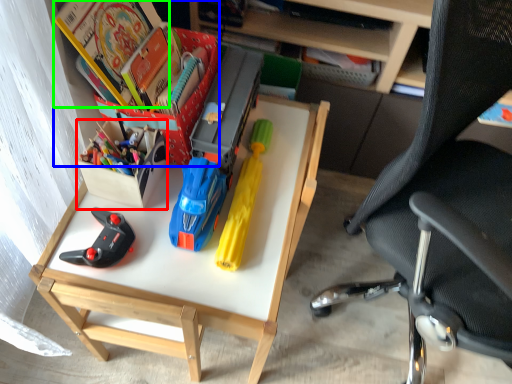
Question: Which object is positioned closest to kit (highlighted by a red box)? Select from book (highlighted by a blue box) and book (highlighted by a green box).

Choices:
 (A) book
 (B) book

Answer: (A)